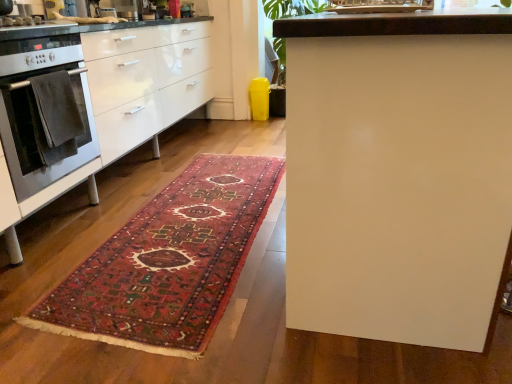
At what (x,y) coordinates should I click in order to perform the action: click on free spot above carpeted rug at center (from a real-world perspective). Please return your answer as a coordinate pair (x, y). Image resolution: width=512 pixels, height=384 pixels. Looking at the image, I should click on (190, 226).